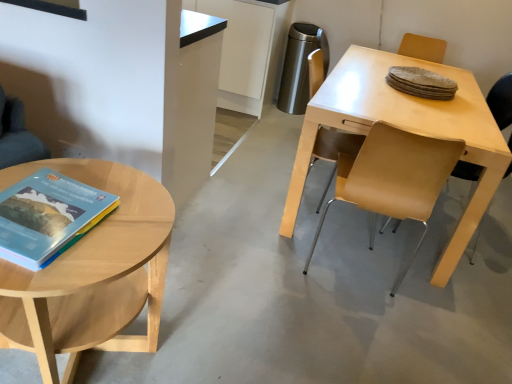
This screenshot has width=512, height=384. What do you see at coordinates (501, 101) in the screenshot? I see `light brown leather chair at right, positioned as the 2th chair in left-to-right order` at bounding box center [501, 101].

Describe the element at coordinates (91, 272) in the screenshot. I see `light brown wood coffee table at left` at that location.

Find the location of a particular element. The height and width of the screenshot is (384, 512). matte hardcover book at left is located at coordinates (48, 217).

In the image, is matte hardcover book at left on the left side or the right side of light brown wood coffee table at left?

Based on their positions, matte hardcover book at left is located to the right of light brown wood coffee table at left.

Can you confirm if matte hardcover book at left is wider than light brown wood coffee table at left?

No.

Who is more distant, matte hardcover book at left or light brown wood coffee table at left?

Positioned behind is matte hardcover book at left.

From the image's perspective, relative to light brown leather chair at center, the first chair from the left, is light brown leather chair at right, positioned as the 2th chair in left-to-right order, above or below?

Clearly, from the image's perspective, light brown leather chair at right, positioned as the 2th chair in left-to-right order, is below light brown leather chair at center, the first chair from the left.

Considering the relative positions of light brown leather chair at right, which appears as the first chair when viewed from the right, and light brown leather chair at center, which appears as the 2th chair when viewed from the right, in the image provided, is light brown leather chair at right, which appears as the first chair when viewed from the right, to the right of light brown leather chair at center, which appears as the 2th chair when viewed from the right, from the viewer's perspective?

Indeed, light brown leather chair at right, which appears as the first chair when viewed from the right, is positioned on the right side of light brown leather chair at center, which appears as the 2th chair when viewed from the right.

From a real-world perspective, between light brown leather chair at right, which appears as the first chair when viewed from the right, and light brown leather chair at center, the first chair from the left, who is vertically higher?

In real-world perspective, light brown leather chair at right, which appears as the first chair when viewed from the right, is above.

Is light brown leather chair at right, which appears as the first chair when viewed from the right, wider or thinner than light brown leather chair at center, the first chair from the left?

Clearly, light brown leather chair at right, which appears as the first chair when viewed from the right, has less width compared to light brown leather chair at center, the first chair from the left.

From the image's perspective, between light wood table at right and light brown leather chair at center, the first chair from the left, who is located below?

light brown leather chair at center, the first chair from the left, is shown below in the image.

At what (x,y) coordinates should I click in order to perform the action: click on desk in front of the light brown leather chair at center, the first chair from the left. Please return your answer as a coordinate pair (x, y). The image size is (512, 384). Looking at the image, I should click on (406, 129).

Which of these two, light wood table at right or light brown leather chair at center, the first chair from the left, stands taller?

With more height is light brown leather chair at center, the first chair from the left.

Which is in front, point (460, 98) or point (341, 135)?

Point (341, 135)

Do you think light wood table at right is within matte hardcover book at left, or outside of it?

light wood table at right is not inside matte hardcover book at left, it's outside.

Image resolution: width=512 pixels, height=384 pixels. Find the location of `desk lying behind the matte hardcover book at left`. desk lying behind the matte hardcover book at left is located at coordinates (406, 129).

From a real-world perspective, relative to matte hardcover book at left, is light wood table at right vertically above or below?

Clearly, from a real-world perspective, light wood table at right is below matte hardcover book at left.

Is light wood table at right oriented towards matte hardcover book at left?

No, light wood table at right is not oriented towards matte hardcover book at left.

From a real-world perspective, starting from the light brown wood coffee table at left, which chair is the 1st one vertically above it? Please provide its 2D coordinates.

[(333, 150)]

Who is more distant, light brown wood coffee table at left or light brown leather chair at center, which appears as the 2th chair when viewed from the right?

light brown leather chair at center, which appears as the 2th chair when viewed from the right, is behind.

Who is smaller, light brown wood coffee table at left or light brown leather chair at center, which appears as the 2th chair when viewed from the right?

With smaller size is light brown leather chair at center, which appears as the 2th chair when viewed from the right.

From a real-world perspective, relative to light brown leather chair at center, the first chair from the left, is light brown wood coffee table at left vertically above or below?

In terms of real-world spatial position, light brown wood coffee table at left is below light brown leather chair at center, the first chair from the left.

Between light brown leather chair at right, positioned as the 2th chair in left-to-right order, and light brown wood coffee table at left, which one appears on the left side from the viewer's perspective?

Positioned to the left is light brown wood coffee table at left.

This screenshot has height=384, width=512. Identify the location of coffee table lying in front of the light brown leather chair at right, positioned as the 2th chair in left-to-right order. (91, 272).

From a real-world perspective, is light brown leather chair at right, which appears as the first chair when viewed from the right, beneath light brown wood coffee table at left?

Actually, light brown leather chair at right, which appears as the first chair when viewed from the right, is physically above light brown wood coffee table at left in the real world.

Can you confirm if light brown leather chair at right, positioned as the 2th chair in left-to-right order, is shorter than light brown wood coffee table at left?

Incorrect, the height of light brown leather chair at right, positioned as the 2th chair in left-to-right order, does not fall short of that of light brown wood coffee table at left.

Find the location of a particular element. The width and height of the screenshot is (512, 384). desk that appears below the light brown leather chair at right, positioned as the 2th chair in left-to-right order (from a real-world perspective) is located at coordinates (406, 129).

Considering the relative sizes of light brown leather chair at right, positioned as the 2th chair in left-to-right order, and light wood table at right in the image provided, is light brown leather chair at right, positioned as the 2th chair in left-to-right order, thinner than light wood table at right?

Yes.

In the scene shown: From a real-world perspective, is light brown leather chair at right, positioned as the 2th chair in left-to-right order, positioned over light wood table at right based on gravity?

Yes, from a real-world perspective, light brown leather chair at right, positioned as the 2th chair in left-to-right order, is on top of light wood table at right.

Is light brown leather chair at right, positioned as the 2th chair in left-to-right order, positioned with its back to light wood table at right?

No, light brown leather chair at right, positioned as the 2th chair in left-to-right order, is not facing away from light wood table at right.

You are a GUI agent. You are given a task and a screenshot of the screen. Output one action in this format:
    pyautogui.click(x=<x>, y=<y>)
    Task: Click on the coffee table that is on the left side of matte hardcover book at left
    The height and width of the screenshot is (384, 512).
    Given the screenshot: What is the action you would take?
    pyautogui.click(x=91, y=272)

This screenshot has width=512, height=384. What are the coordinates of `chair that is under the light brown leather chair at right, which appears as the first chair when viewed from the right (from a real-world perspective)` in the screenshot? It's located at (333, 150).

Considering their positions, is light brown leather chair at center, which appears as the 2th chair when viewed from the right, positioned further to light brown wood coffee table at left than matte hardcover book at left?

light brown leather chair at center, which appears as the 2th chair when viewed from the right.

From the image, which object appears to be nearer to light brown leather chair at right, which appears as the first chair when viewed from the right, light brown leather chair at center, the first chair from the left, or light wood table at right?

The object closer to light brown leather chair at right, which appears as the first chair when viewed from the right, is light wood table at right.

Which object lies nearer to the anchor point matte hardcover book at left, light wood table at right or light brown leather chair at right, positioned as the 2th chair in left-to-right order?

Among the two, light wood table at right is located nearer to matte hardcover book at left.

Which object lies further to the anchor point matte hardcover book at left, light brown wood coffee table at left or light wood table at right?

The object further to matte hardcover book at left is light wood table at right.

In the scene shown: Based on their spatial positions, is light brown leather chair at right, which appears as the first chair when viewed from the right, or matte hardcover book at left closer to light brown wood coffee table at left?

The object closer to light brown wood coffee table at left is matte hardcover book at left.

When comparing their distances from light brown wood coffee table at left, does light wood table at right or matte hardcover book at left seem closer?

Answer: matte hardcover book at left lies closer to light brown wood coffee table at left than the other object.

Looking at the image, which one is located further to matte hardcover book at left, light wood table at right or light brown wood coffee table at left?

Based on the image, light wood table at right appears to be further to matte hardcover book at left.

From the image, which object appears to be nearer to matte hardcover book at left, light brown leather chair at center, which appears as the 2th chair when viewed from the right, or light brown leather chair at right, which appears as the first chair when viewed from the right?

light brown leather chair at center, which appears as the 2th chair when viewed from the right, is positioned closer to the anchor matte hardcover book at left.

Locate an element on the screen. This screenshot has width=512, height=384. chair between matte hardcover book at left and light wood table at right in the horizontal direction is located at coordinates (333, 150).

This screenshot has width=512, height=384. In order to click on book between light brown wood coffee table at left and light brown leather chair at center, which appears as the 2th chair when viewed from the right, from left to right in this screenshot , I will do `click(48, 217)`.

This screenshot has width=512, height=384. Find the location of `desk located between light brown wood coffee table at left and light brown leather chair at right, which appears as the first chair when viewed from the right, in the left-right direction`. desk located between light brown wood coffee table at left and light brown leather chair at right, which appears as the first chair when viewed from the right, in the left-right direction is located at coordinates (406, 129).

Locate an element on the screen. This screenshot has height=384, width=512. chair between light brown wood coffee table at left and light brown leather chair at right, which appears as the first chair when viewed from the right, in the horizontal direction is located at coordinates (333, 150).